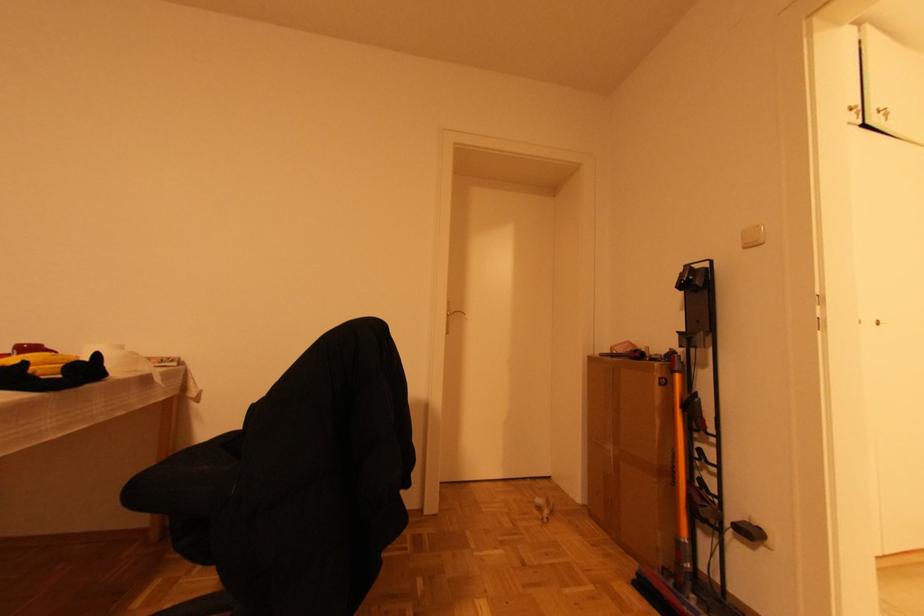
Find the location of a particular element. The width and height of the screenshot is (924, 616). black chair armrest is located at coordinates (199, 455).